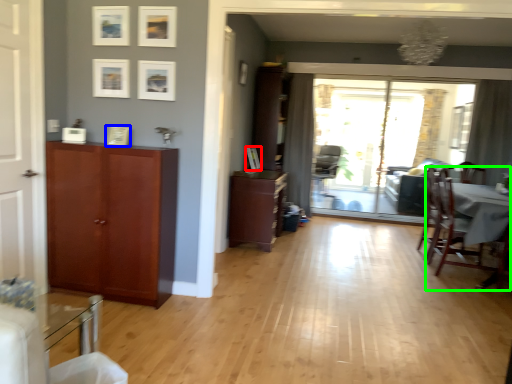
Question: Which object is the farthest from picture frame (highlighted by a red box)? Choose among these: picture frame (highlighted by a blue box) or chair (highlighted by a green box).

Choices:
 (A) picture frame
 (B) chair

Answer: (B)